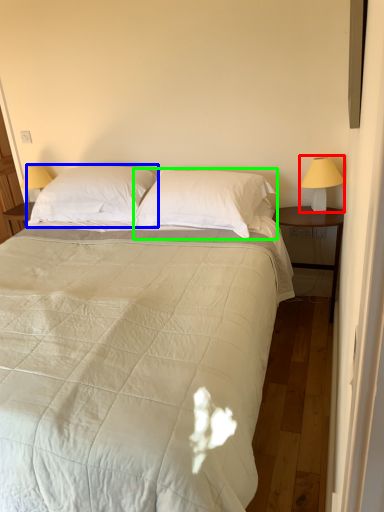
Question: Which is nearer to the bedside lamp (highlighted by a red box)? pillow (highlighted by a blue box) or pillow (highlighted by a green box).

Choices:
 (A) pillow
 (B) pillow

Answer: (B)